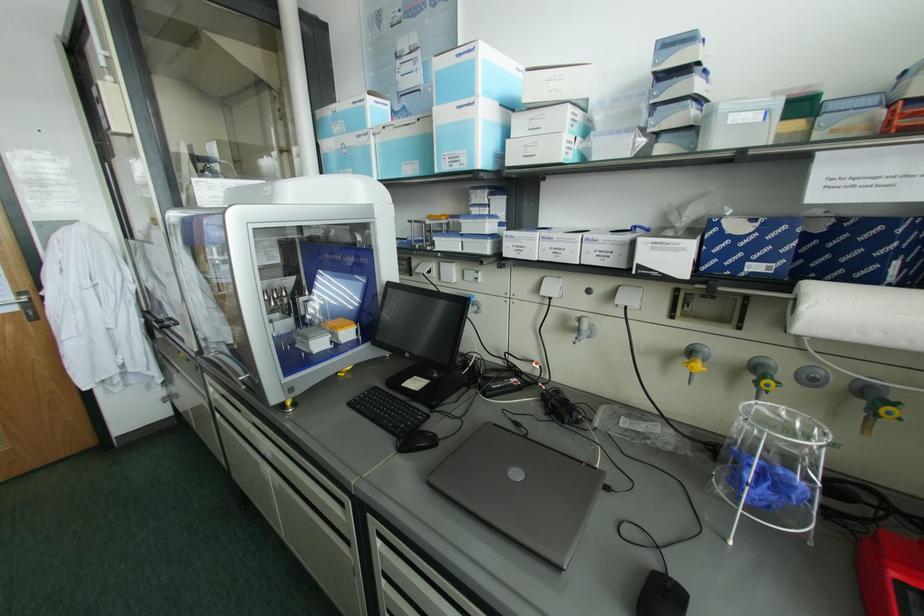
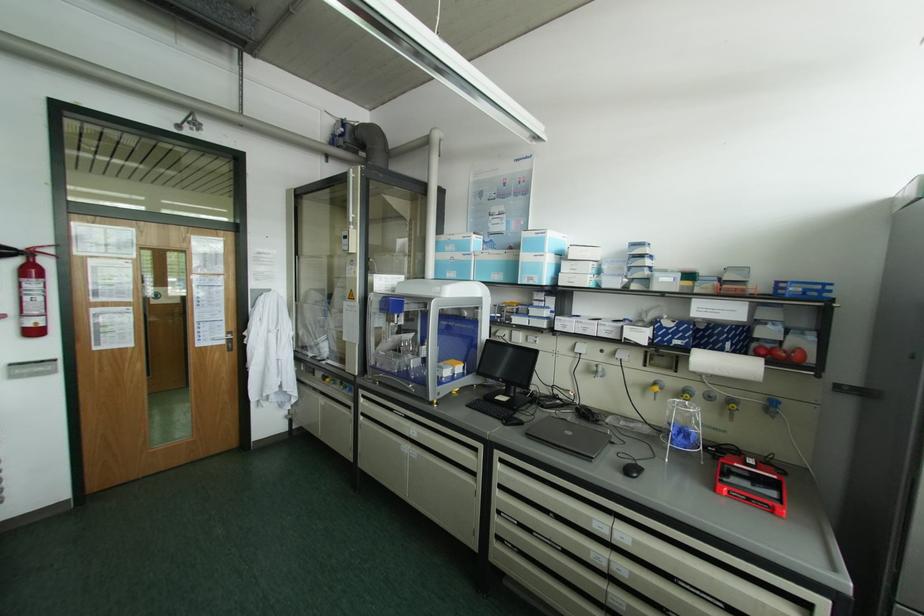
Find the pixel in the second image that matches point (454, 159) in the first image.

(530, 278)